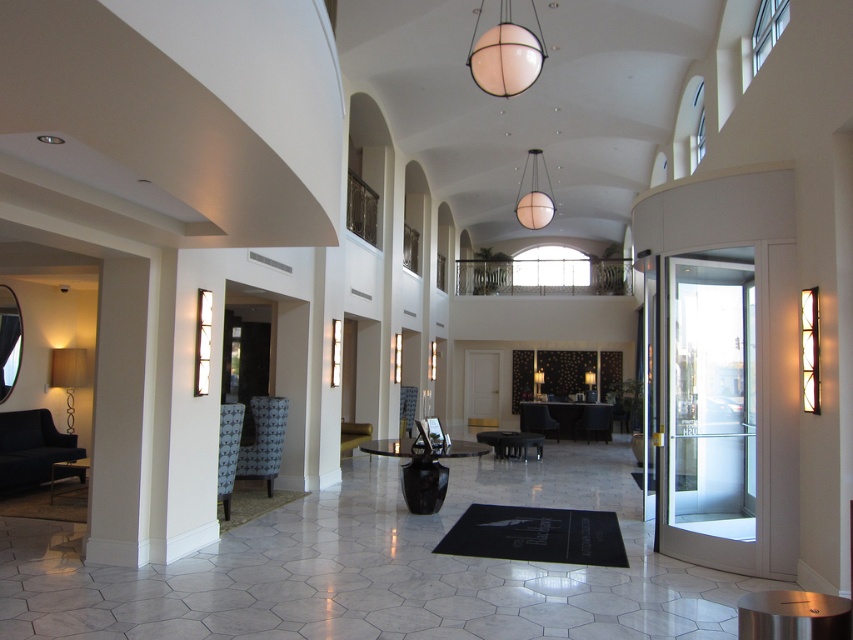
Describe the element at coordinates (506, 56) in the screenshot. This screenshot has width=853, height=640. I see `white matte globe at upper center` at that location.

Is white matte globe at upper center smaller than white matte sphere at upper center?

Actually, white matte globe at upper center might be larger than white matte sphere at upper center.

Find the location of a particular element. white matte globe at upper center is located at coordinates (506, 56).

Which is more to the left, patterned fabric armchair at left or white matte sphere at upper center?

patterned fabric armchair at left

Measure the distance from patterned fabric armchair at left to white matte sphere at upper center.

8.20 meters

Describe the element at coordinates (228, 451) in the screenshot. This screenshot has height=640, width=853. I see `patterned fabric armchair at left` at that location.

Locate an element on the screen. patterned fabric armchair at left is located at coordinates (228, 451).

Who is shorter, white matte sphere at upper center or patterned fabric armchair at center?

With less height is white matte sphere at upper center.

Does white matte sphere at upper center lie behind patterned fabric armchair at center?

No.

Locate an element on the screen. The width and height of the screenshot is (853, 640). white matte sphere at upper center is located at coordinates (534, 196).